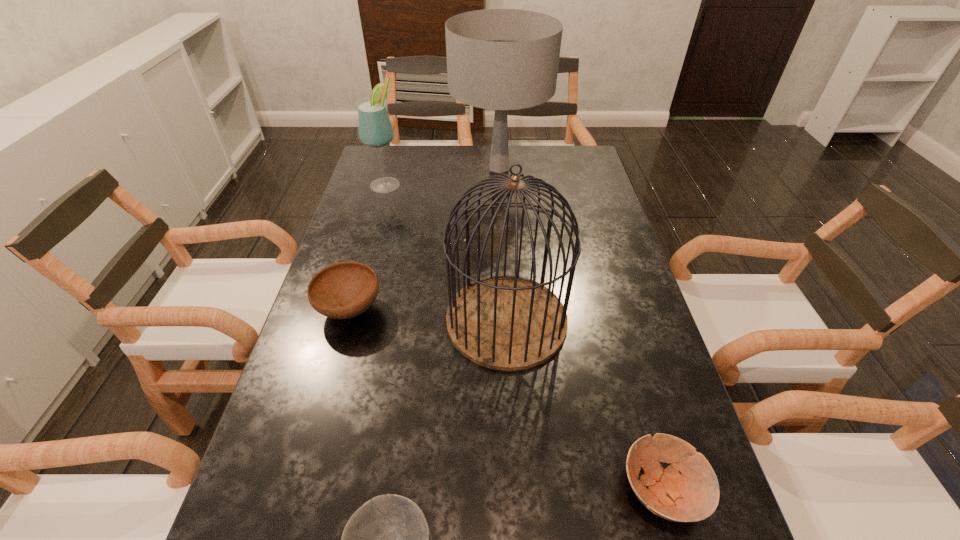
Identify the location of lampshade. (x=500, y=59).

Identify the location of birdcage. point(503,322).

What are the coordinates of `alcohol` in the screenshot? It's located at (375, 129).

Find the location of a particular element. the farthest bowl is located at coordinates (343, 290).

Where is `the leftmost bowl`? The image size is (960, 540). the leftmost bowl is located at coordinates (343, 290).

Find the location of a particular element. This screenshot has height=540, width=960. the rightmost object is located at coordinates (692, 496).

Identify the location of vacant area situated on the front-facing side of the lampshade. This screenshot has width=960, height=540. (502, 220).

Locate an element on the screen. Image resolution: width=960 pixels, height=540 pixels. vacant region located 0.150m at the door of the birdcage is located at coordinates (384, 320).

Where is `blank space located 0.080m at the door of the birdcage`? The image size is (960, 540). blank space located 0.080m at the door of the birdcage is located at coordinates (413, 320).

The image size is (960, 540). I want to click on free space located 0.220m at the door of the birdcage, so point(355,320).